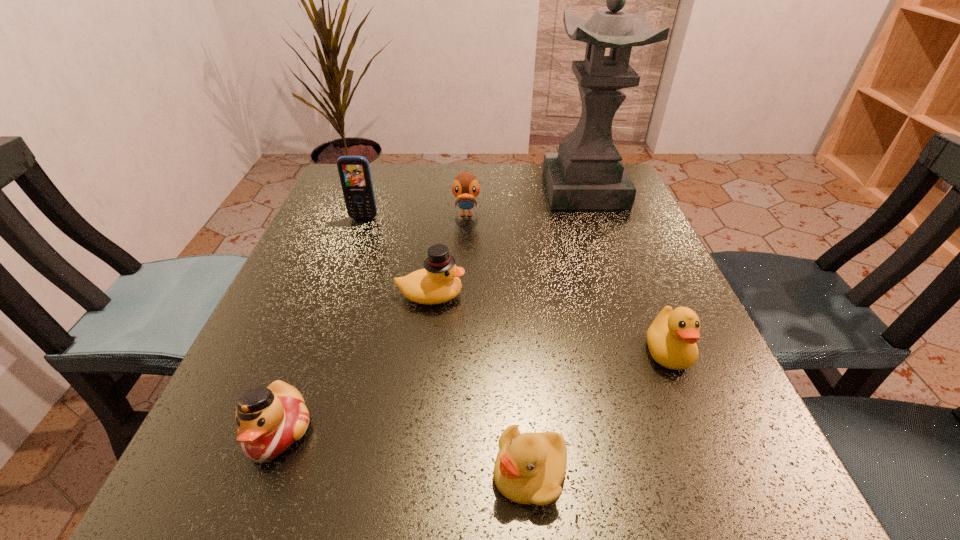
Where is `vacant area between the fifth object from left to right and the leftmost duck`? This screenshot has width=960, height=540. vacant area between the fifth object from left to right and the leftmost duck is located at coordinates (404, 451).

You are a GUI agent. You are given a task and a screenshot of the screen. Output one action in this format:
    pyautogui.click(x=<x>, y=<y>)
    Task: Click on the free space that is in between the fifth farthest object and the sculpture
    This screenshot has width=960, height=540.
    Given the screenshot: What is the action you would take?
    pyautogui.click(x=626, y=271)

You are a GUI agent. You are given a task and a screenshot of the screen. Output one action in this format:
    pyautogui.click(x=<x>, y=<y>)
    Task: Click on the closest object to the farthest duck
    The image size is (960, 540).
    Given the screenshot: What is the action you would take?
    pyautogui.click(x=587, y=172)

Identify which object is the sixth closest to the cellular telephone. Please provide its 2D coordinates. Your answer should be formatted as a tuple, i.e. [(x, y)], where the tuple contains the x and y coordinates of a point satisfying the conditions above.

[(671, 338)]

Select which duck appears as the third closest to the tallest object. Please provide its 2D coordinates. Your answer should be formatted as a tuple, i.e. [(x, y)], where the tuple contains the x and y coordinates of a point satisfying the conditions above.

[(671, 338)]

Identify the location of the closest duck to the cellular telephone. (465, 187).

Locate an element on the screen. vacant area in the image that satisfies the following two spatial constraints: 1. on the front-facing side of the farthest duck; 2. on the front-facing side of the third nearest duck is located at coordinates (463, 295).

Find the location of `free space that satisfies the following two spatial constraints: 1. on the front-facing side of the farthest duck; 2. on the front-facing side of the third nearest duck`. free space that satisfies the following two spatial constraints: 1. on the front-facing side of the farthest duck; 2. on the front-facing side of the third nearest duck is located at coordinates (463, 295).

Identify the location of vacant space that satisfies the following two spatial constraints: 1. at the front opening of the tallest object; 2. on the beak of the fifth object from left to right. The height and width of the screenshot is (540, 960). (684, 472).

Where is `free space that satisfies the following two spatial constraints: 1. on the front-facing side of the fourth nearest object; 2. on the face of the nearest duck`? free space that satisfies the following two spatial constraints: 1. on the front-facing side of the fourth nearest object; 2. on the face of the nearest duck is located at coordinates (414, 431).